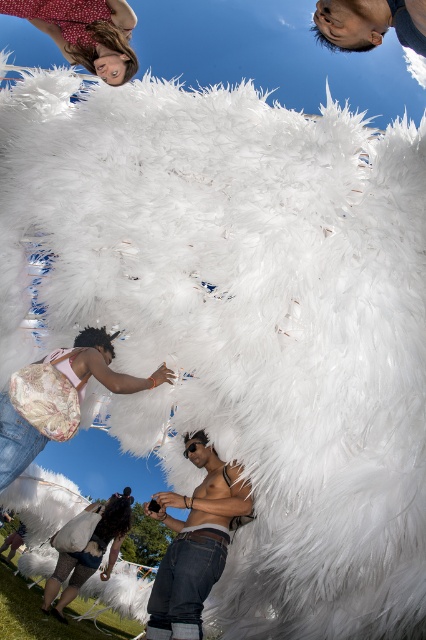
Question: Is matte red dress at upper left to the left of matte white feathers at lower left from the viewer's perspective?

Choices:
 (A) yes
 (B) no

Answer: (B)

Question: Which object appears closest to the camera in this image?

Choices:
 (A) leather backpack at lower left
 (B) matte white feathers at lower left
 (C) matte red dress at upper left

Answer: (C)

Question: Which point appears closest to the camera in this image?

Choices:
 (A) (178, 614)
 (B) (117, 493)
 (C) (123, 40)
 (D) (109, 384)

Answer: (A)

Question: Does shiny metallic phone at center come behind smooth skin head at upper right?

Choices:
 (A) yes
 (B) no

Answer: (A)

Question: From the image, what is the correct spatial relationship of leather backpack at lower left in relation to smooth skin head at upper right?

Choices:
 (A) right
 (B) left

Answer: (B)

Question: Which point appears closest to the camera in this image?

Choices:
 (A) (77, 60)
 (B) (331, 44)

Answer: (B)